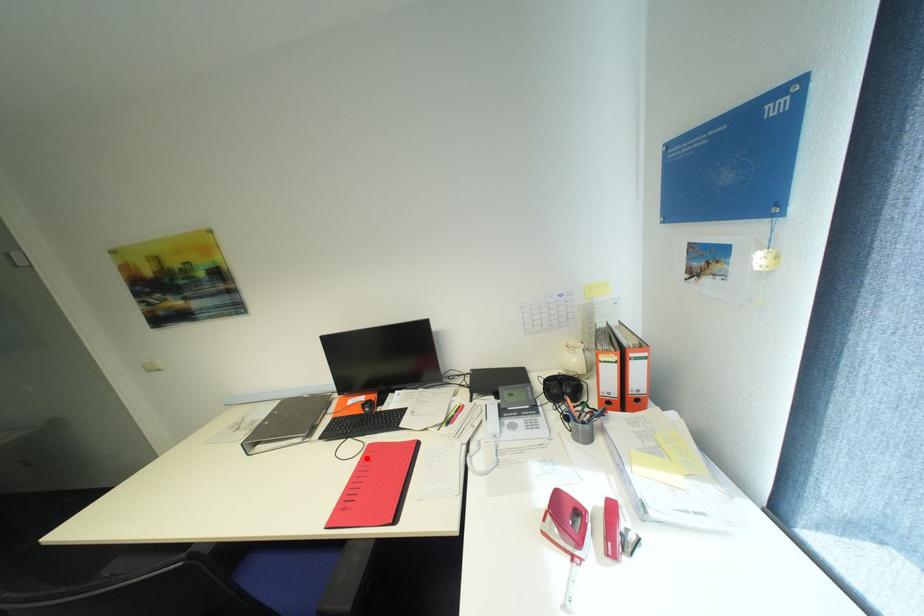
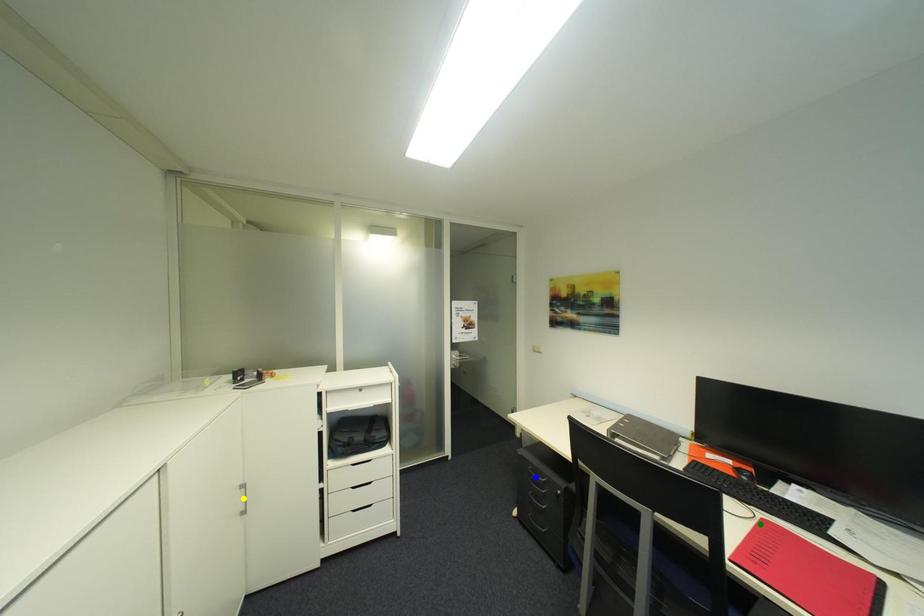
Question: I am providing you with two images of the same scene from different viewpoints. A red point is marked on the first image. You are given multiple points on the second image. In image 2, which mark is for the same physical point as the one in image 1?

Choices:
 (A) blue point
 (B) green point
 (C) yellow point

Answer: (B)